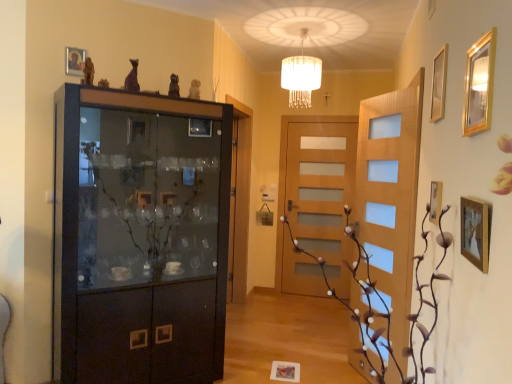
Question: Is gold metallic picture frame at upper right, marked as the first picture frame in a right-to-left arrangement, positioned in front of wooden picture frame at lower center, which is the 1th picture frame from back to front?

Choices:
 (A) yes
 (B) no

Answer: (A)

Question: From the image's perspective, does gold metallic picture frame at upper right, acting as the fifth picture frame starting from the left, appear lower than wooden picture frame at lower center, marked as the 5th picture frame in a front-to-back arrangement?

Choices:
 (A) yes
 (B) no

Answer: (B)

Question: Does gold metallic picture frame at upper right, positioned as the 2th picture frame in top-to-bottom order, turn towards wooden picture frame at lower center, marked as the fifth picture frame in a top-to-bottom arrangement?

Choices:
 (A) yes
 (B) no

Answer: (B)

Question: From a real-world perspective, is gold metallic picture frame at upper right, positioned as the 2th picture frame in top-to-bottom order, positioned under wooden picture frame at lower center, marked as the fifth picture frame in a top-to-bottom arrangement, based on gravity?

Choices:
 (A) yes
 (B) no

Answer: (B)

Question: From a real-world perspective, is gold metallic picture frame at upper right, acting as the fifth picture frame starting from the left, over wooden picture frame at lower center, which is the 1th picture frame from back to front?

Choices:
 (A) no
 (B) yes

Answer: (B)

Question: In terms of width, does wooden picture frame at lower center, marked as the fifth picture frame in a top-to-bottom arrangement, look wider or thinner when compared to gold-framed mirror at upper right, positioned as the 2th picture frame in right-to-left order?

Choices:
 (A) wide
 (B) thin

Answer: (A)

Question: Based on their sizes in the image, would you say wooden picture frame at lower center, marked as the 5th picture frame in a front-to-back arrangement, is bigger or smaller than gold-framed mirror at upper right, positioned as the 2th picture frame in right-to-left order?

Choices:
 (A) big
 (B) small

Answer: (B)

Question: Relative to gold-framed mirror at upper right, arranged as the fourth picture frame when viewed from the left, is wooden picture frame at lower center, acting as the fourth picture frame starting from the right, in front or behind?

Choices:
 (A) behind
 (B) front

Answer: (A)

Question: Is wooden picture frame at lower center, the second picture frame when ordered from left to right, inside the boundaries of gold-framed mirror at upper right, which appears as the third picture frame when viewed from the top, or outside?

Choices:
 (A) outside
 (B) inside

Answer: (A)

Question: Is matte black cabinet at left wider or thinner than matte purple statue at upper center, the first art positioned from the front?

Choices:
 (A) wide
 (B) thin

Answer: (A)

Question: From a real-world perspective, relative to matte purple statue at upper center, placed as the 1th art when sorted from left to right, is matte black cabinet at left vertically above or below?

Choices:
 (A) below
 (B) above

Answer: (A)

Question: Is matte black cabinet at left taller or shorter than matte purple statue at upper center, the 2th art from the right?

Choices:
 (A) short
 (B) tall

Answer: (B)

Question: Considering the positions of matte black cabinet at left and matte purple statue at upper center, the first art positioned from the front, in the image, is matte black cabinet at left bigger or smaller than matte purple statue at upper center, the first art positioned from the front,?

Choices:
 (A) small
 (B) big

Answer: (B)

Question: Looking at their shapes, would you say brown textured plant at center is wider or thinner than wooden picture frame at right, which is counted as the 3th picture frame, starting from the left?

Choices:
 (A) thin
 (B) wide

Answer: (B)

Question: In terms of height, does brown textured plant at center look taller or shorter compared to wooden picture frame at right, the 4th picture frame from the top?

Choices:
 (A) short
 (B) tall

Answer: (B)